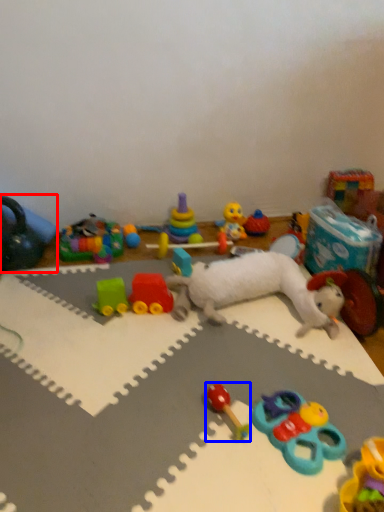
Question: Which point is closer to the camera, toy (highlighted by a red box) or toy (highlighted by a blue box)?

Choices:
 (A) toy
 (B) toy

Answer: (B)